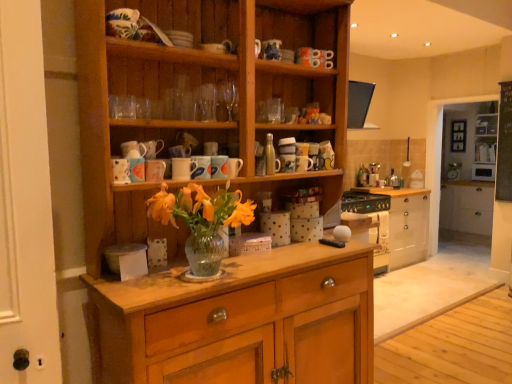
Question: From a real-world perspective, is white glossy cabinet at right, which is counted as the 2th shelf, starting from the back, physically above glossy ceramic mug at upper center, which ranks as the fifth mug in left-to-right order?

Choices:
 (A) no
 (B) yes

Answer: (A)

Question: Does white glossy cabinet at right, which is counted as the 2th shelf, starting from the back, turn towards glossy ceramic mug at upper center, which ranks as the fifth mug in left-to-right order?

Choices:
 (A) yes
 (B) no

Answer: (A)

Question: Is white glossy cabinet at right, which is counted as the second shelf, starting from the right, to the left of glossy ceramic mug at upper center, positioned as the second mug in right-to-left order, from the viewer's perspective?

Choices:
 (A) no
 (B) yes

Answer: (A)

Question: From a real-world perspective, is white glossy cabinet at right, which is counted as the 2th shelf, starting from the back, positioned under glossy ceramic mug at upper center, positioned as the second mug in right-to-left order, based on gravity?

Choices:
 (A) no
 (B) yes

Answer: (B)

Question: Considering the relative sizes of white glossy cabinet at right, which is counted as the 2th shelf, starting from the back, and glossy ceramic mug at upper center, positioned as the second mug in right-to-left order, in the image provided, is white glossy cabinet at right, which is counted as the 2th shelf, starting from the back, shorter than glossy ceramic mug at upper center, positioned as the second mug in right-to-left order,?

Choices:
 (A) yes
 (B) no

Answer: (B)

Question: Is glossy ceramic mug at upper center, positioned as the second mug in right-to-left order, wider or thinner than white painted wood cabinet at right?

Choices:
 (A) wide
 (B) thin

Answer: (B)

Question: Considering the positions of glossy ceramic mug at upper center, which ranks as the fifth mug in left-to-right order, and white painted wood cabinet at right in the image, is glossy ceramic mug at upper center, which ranks as the fifth mug in left-to-right order, taller or shorter than white painted wood cabinet at right?

Choices:
 (A) short
 (B) tall

Answer: (A)

Question: From a real-world perspective, is glossy ceramic mug at upper center, positioned as the second mug in right-to-left order, positioned above or below white painted wood cabinet at right?

Choices:
 (A) below
 (B) above

Answer: (B)

Question: From the image's perspective, is glossy ceramic mug at upper center, which ranks as the fifth mug in left-to-right order, above or below white painted wood cabinet at right?

Choices:
 (A) above
 (B) below

Answer: (A)

Question: Would you say matte ceramic mug at upper center, the 5th mug positioned from the right, is to the left or to the right of white glossy cabinet at right, which is the first shelf from front to back, in the picture?

Choices:
 (A) left
 (B) right

Answer: (A)

Question: Based on their sizes in the image, would you say matte ceramic mug at upper center, which ranks as the second mug in left-to-right order, is bigger or smaller than white glossy cabinet at right, which is counted as the 2th shelf, starting from the back?

Choices:
 (A) small
 (B) big

Answer: (A)

Question: From the image's perspective, is matte ceramic mug at upper center, the 5th mug positioned from the right, located above or below white glossy cabinet at right, which is counted as the second shelf, starting from the right?

Choices:
 (A) above
 (B) below

Answer: (B)

Question: Is matte ceramic mug at upper center, the 5th mug positioned from the right, wider or thinner than white glossy cabinet at right, which is the first shelf in left-to-right order?

Choices:
 (A) wide
 (B) thin

Answer: (B)

Question: Is matte ceramic mug at upper center, which ranks as the second mug in left-to-right order, wider or thinner than matte ceramic mug at upper center, positioned as the first mug in left-to-right order?

Choices:
 (A) wide
 (B) thin

Answer: (A)

Question: Is matte ceramic mug at upper center, the 5th mug positioned from the right, to the left or to the right of matte ceramic mug at upper center, positioned as the first mug in left-to-right order, in the image?

Choices:
 (A) right
 (B) left

Answer: (A)